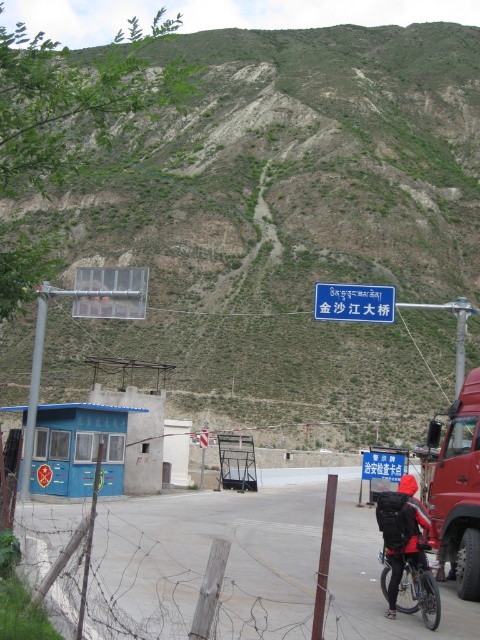
Question: Where is red matte truck at right located in relation to blue plastic sign at center in the image?

Choices:
 (A) left
 (B) right

Answer: (B)

Question: Which point is closer to the camera taking this photo?

Choices:
 (A) (430, 600)
 (B) (324, 284)
 (C) (437, 538)

Answer: (A)

Question: Which point appears closest to the camera in this image?

Choices:
 (A) (439, 529)
 (B) (336, 291)
 (C) (416, 573)

Answer: (C)

Question: Where is blue plastic sign at center located in relation to silver metallic bicycle at lower center in the image?

Choices:
 (A) above
 (B) below

Answer: (A)

Question: Among these objects, which one is nearest to the camera?

Choices:
 (A) silver metallic bicycle at lower center
 (B) red matte truck at right

Answer: (A)

Question: Is red matte truck at right bigger than blue plastic sign at center?

Choices:
 (A) yes
 (B) no

Answer: (A)